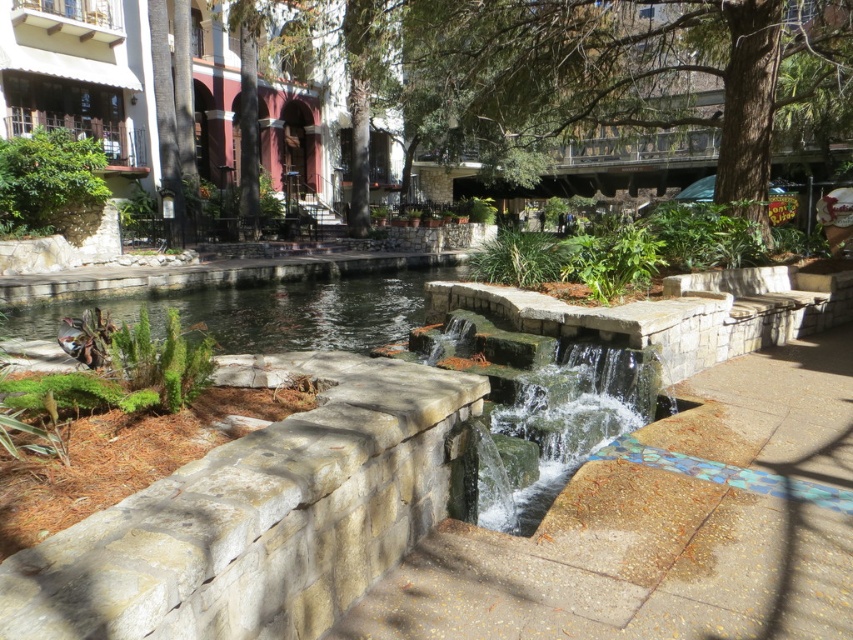
Question: Estimate the real-world distances between objects in this image. Which object is farther from the green leafy tree at upper center?

Choices:
 (A) smooth concrete steps at center
 (B) clear water at center
 (C) green mossy stone waterfall at center

Answer: (A)

Question: Does green leafy tree at upper center have a smaller size compared to green mossy stone waterfall at center?

Choices:
 (A) yes
 (B) no

Answer: (B)

Question: Which object is positioned farthest from the green leafy tree at upper center?

Choices:
 (A) smooth concrete steps at center
 (B) green mossy stone waterfall at center

Answer: (A)

Question: Which object is closer to the camera taking this photo?

Choices:
 (A) green mossy stone waterfall at center
 (B) green leafy tree at upper center

Answer: (A)

Question: In this image, where is smooth concrete steps at center located relative to green leafy tree at upper center?

Choices:
 (A) below
 (B) above

Answer: (A)

Question: Can you confirm if smooth concrete steps at center is positioned to the right of green mossy stone waterfall at center?

Choices:
 (A) yes
 (B) no

Answer: (B)